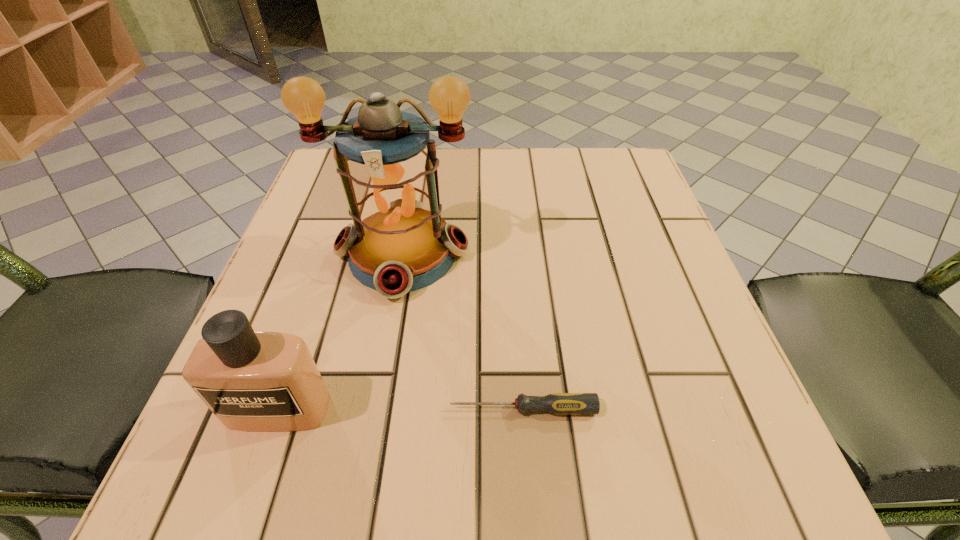
I want to click on free space between the screwdriver and the farthest object, so click(x=463, y=331).

Find the location of a particular element. Image resolution: width=960 pixels, height=540 pixels. empty space that is in between the tallest object and the second shortest object is located at coordinates (341, 331).

At what (x,y) coordinates should I click in order to perform the action: click on vacant space that's between the farthest object and the shortest object. Please return your answer as a coordinate pair (x, y). The height and width of the screenshot is (540, 960). Looking at the image, I should click on (463, 331).

Identify the location of free space that is in between the perfume and the lantern. (341, 331).

I want to click on vacant area that lies between the perfume and the shortest object, so click(400, 409).

Image resolution: width=960 pixels, height=540 pixels. Identify the location of empty location between the perfume and the tallest object. (341, 331).

Find the location of `empty space between the tallest object and the shortest object`. empty space between the tallest object and the shortest object is located at coordinates (463, 331).

The image size is (960, 540). In order to click on vacant area that lies between the tallest object and the perfume in this screenshot , I will do `click(341, 331)`.

The width and height of the screenshot is (960, 540). In order to click on free space between the farthest object and the second shortest object in this screenshot , I will do [x=341, y=331].

Locate an element on the screen. The image size is (960, 540). object that can be found as the closest to the second tallest object is located at coordinates (399, 243).